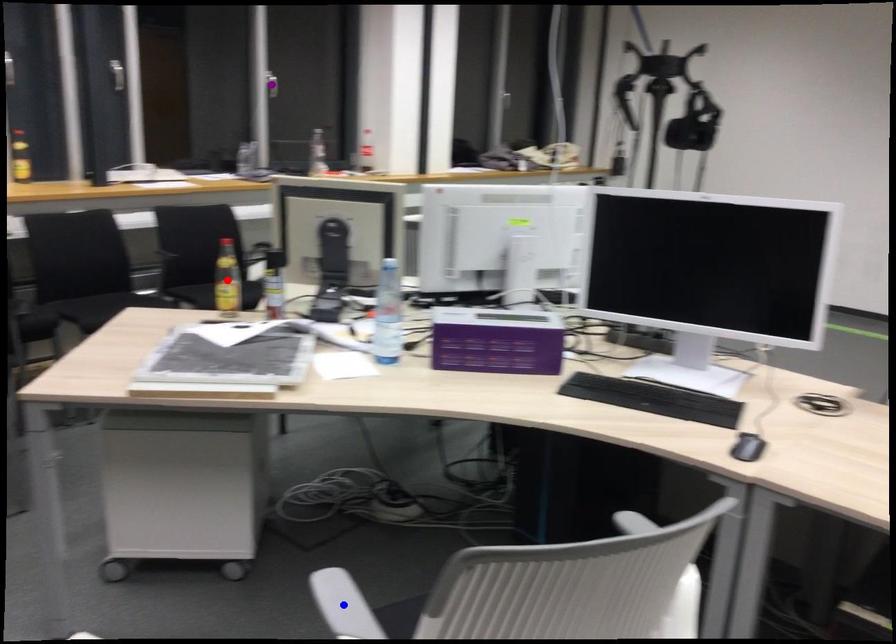
Order these from farthest to nearest:
- purple point
- blue point
- red point

purple point → red point → blue point